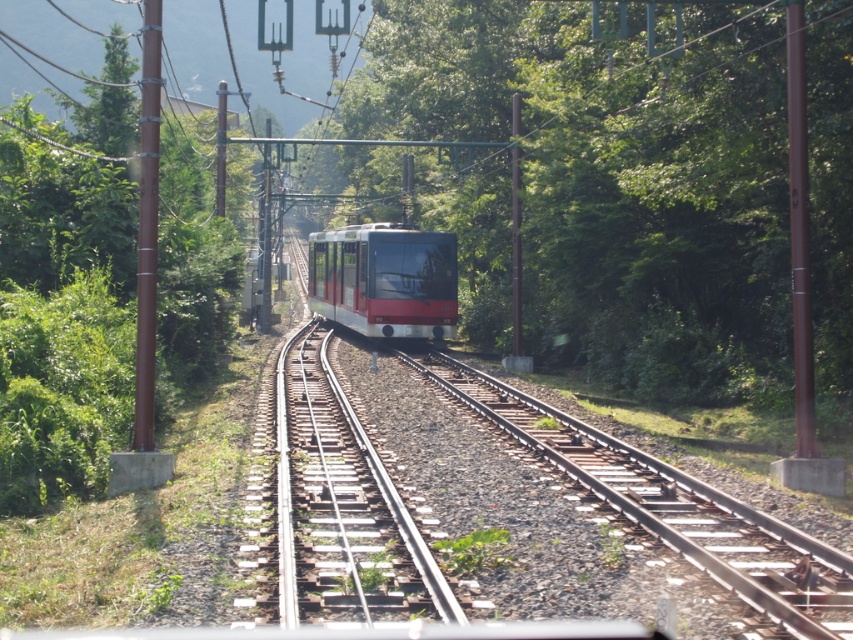
Is point (709, 298) positioned after point (386, 225)?

No, (709, 298) is in front of (386, 225).

Is green leafy tree at center wider than red glossy tram at center?

Yes, green leafy tree at center is wider than red glossy tram at center.

Describe the element at coordinates (616, 182) in the screenshot. I see `green leafy tree at center` at that location.

Where is `green leafy tree at center`? Image resolution: width=853 pixels, height=640 pixels. green leafy tree at center is located at coordinates (616, 182).

Is smooth metal train track at center bigger than red glossy tram at center?

Actually, smooth metal train track at center might be smaller than red glossy tram at center.

Does smooth metal train track at center appear under red glossy tram at center?

Yes.

What do you see at coordinates (674, 508) in the screenshot?
I see `smooth metal train track at center` at bounding box center [674, 508].

This screenshot has height=640, width=853. Identify the location of smooth metal train track at center. tap(674, 508).

Does green leafy tree at center appear under metallic train track at center?

No, green leafy tree at center is not below metallic train track at center.

Between green leafy tree at center and metallic train track at center, which one is positioned lower?

metallic train track at center

The width and height of the screenshot is (853, 640). I want to click on green leafy tree at center, so (616, 182).